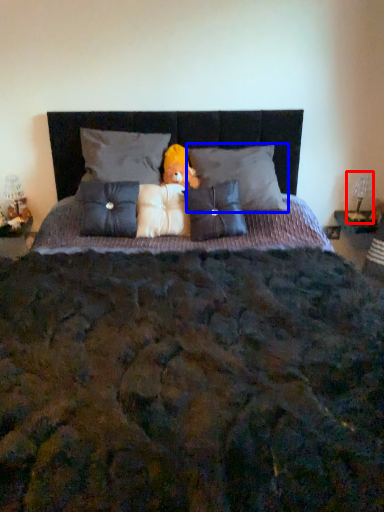
Question: Which of the following is the farthest to the observer, table lamp (highlighted by a red box) or pillow (highlighted by a blue box)?

Choices:
 (A) table lamp
 (B) pillow

Answer: (A)